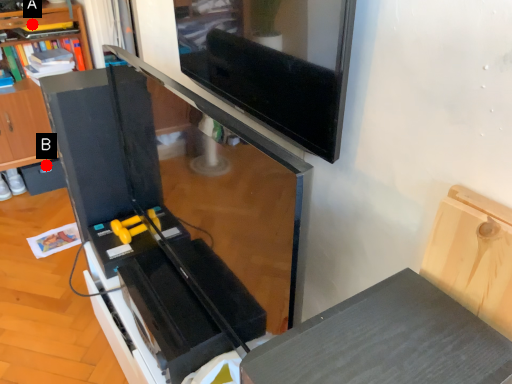
Question: Two points are circled on the image, labeled by A and B beside each circle. Which point is farther to the camera?

Choices:
 (A) A is further
 (B) B is further

Answer: (B)